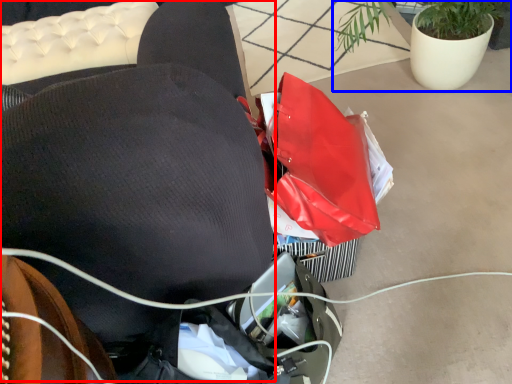
Question: Which object appears closest to the camera in this image, bean bag chair (highlighted by a red box) or houseplant (highlighted by a blue box)?

Choices:
 (A) bean bag chair
 (B) houseplant

Answer: (A)